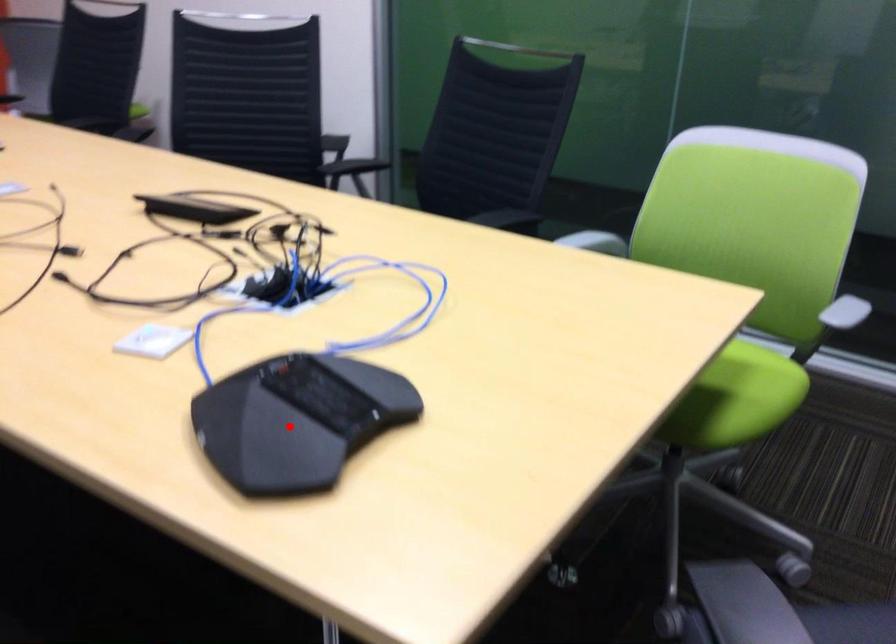
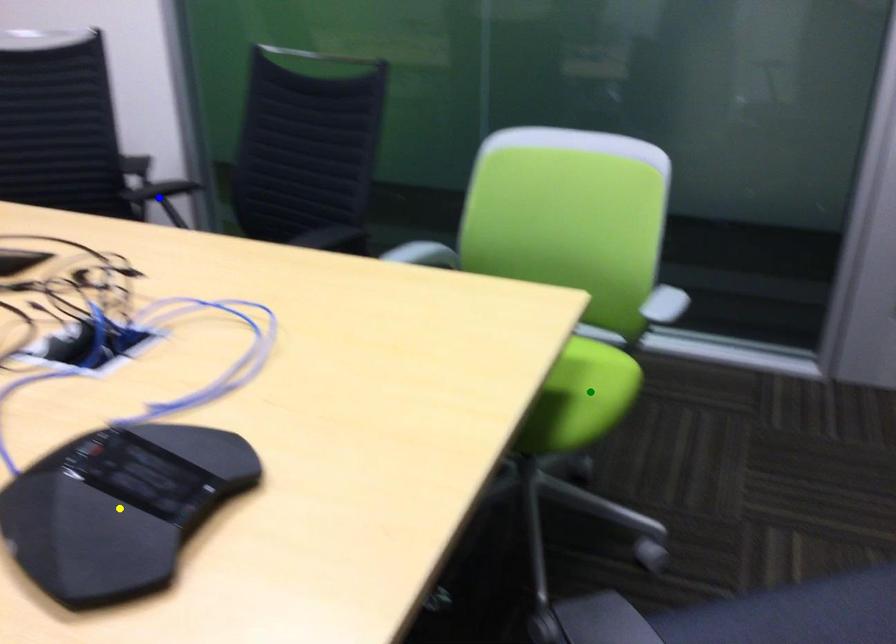
Question: I am providing you with two images of the same scene from different viewpoints. A red point is marked on the first image. You are given multiple points on the second image. Which point in image 2 represents the same 3d spot as the red point in image 1?

Choices:
 (A) blue point
 (B) green point
 (C) yellow point

Answer: (C)